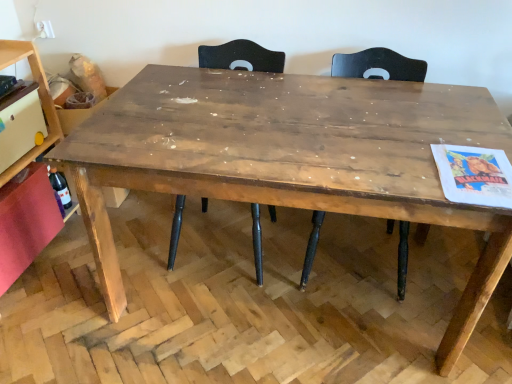
Question: From the image's perspective, is translucent glass bottle at lower left under rustic wood table at center?

Choices:
 (A) yes
 (B) no

Answer: (B)

Question: Does translucent glass bottle at lower left come behind rustic wood table at center?

Choices:
 (A) yes
 (B) no

Answer: (A)

Question: From a real-world perspective, is translucent glass bottle at lower left positioned under rustic wood table at center based on gravity?

Choices:
 (A) yes
 (B) no

Answer: (A)

Question: Is translucent glass bottle at lower left facing towards rustic wood table at center?

Choices:
 (A) no
 (B) yes

Answer: (B)

Question: Is translucent glass bottle at lower left beside rustic wood table at center?

Choices:
 (A) no
 (B) yes

Answer: (A)

Question: Is translucent glass bottle at lower left closer to camera compared to rustic wood table at center?

Choices:
 (A) yes
 (B) no

Answer: (B)

Question: From a real-world perspective, is wooden shelf at left, the 1th shelf in the bottom-to-top sequence, physically below dark brown wood chair at center, which is the 2th chair in right-to-left order?

Choices:
 (A) yes
 (B) no

Answer: (B)

Question: Is wooden shelf at left, acting as the second shelf starting from the top, oriented towards dark brown wood chair at center, which is the 1th chair from left to right?

Choices:
 (A) yes
 (B) no

Answer: (A)

Question: Is wooden shelf at left, the 1th shelf in the bottom-to-top sequence, thinner than dark brown wood chair at center, which is the 1th chair from left to right?

Choices:
 (A) yes
 (B) no

Answer: (A)

Question: Does wooden shelf at left, the 1th shelf in the bottom-to-top sequence, contain dark brown wood chair at center, which is the 2th chair in right-to-left order?

Choices:
 (A) no
 (B) yes

Answer: (A)

Question: Considering the relative sizes of wooden shelf at left, the 1th shelf in the bottom-to-top sequence, and dark brown wood chair at center, which is the 2th chair in right-to-left order, in the image provided, is wooden shelf at left, the 1th shelf in the bottom-to-top sequence, smaller than dark brown wood chair at center, which is the 2th chair in right-to-left order,?

Choices:
 (A) no
 (B) yes

Answer: (B)

Question: Considering the relative sizes of wooden shelf at left, the 1th shelf in the bottom-to-top sequence, and dark brown wood chair at center, which is the 2th chair in right-to-left order, in the image provided, is wooden shelf at left, the 1th shelf in the bottom-to-top sequence, bigger than dark brown wood chair at center, which is the 2th chair in right-to-left order,?

Choices:
 (A) yes
 (B) no

Answer: (B)

Question: Is matte black chair at upper center, placed as the 1th chair when sorted from right to left, surrounding translucent glass bottle at lower left?

Choices:
 (A) no
 (B) yes

Answer: (A)